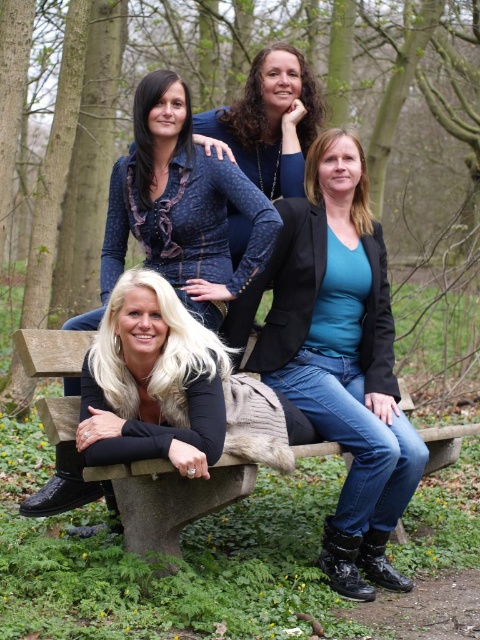
Question: Which of the following is the farthest from the observer?

Choices:
 (A) (187, 253)
 (B) (56, 348)
 (C) (314, 275)

Answer: (C)

Question: Does teal matte blazer at center appear over black leather jacket at lower left?

Choices:
 (A) no
 (B) yes

Answer: (A)

Question: Which object is positioned farthest from the concrete bench at center?

Choices:
 (A) black leather jacket at lower left
 (B) teal matte blazer at center

Answer: (A)

Question: Estimate the real-world distances between objects in this image. Which object is farther from the concrete bench at center?

Choices:
 (A) black leather jacket at lower left
 (B) teal matte blazer at center

Answer: (A)

Question: From the image, what is the correct spatial relationship of black leather jacket at lower left in relation to concrete bench at center?

Choices:
 (A) above
 (B) below

Answer: (A)

Question: Is black leather jacket at lower left behind concrete bench at center?

Choices:
 (A) yes
 (B) no

Answer: (A)